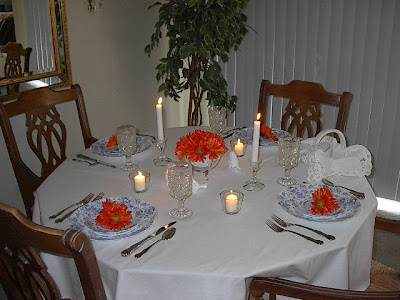
You are a GUI agent. You are given a task and a screenshot of the screen. Output one action in this format:
    pyautogui.click(x=<x>, y=<y>)
    Task: Click on the silverware
    The image size is (400, 300).
    Given the screenshot: What is the action you would take?
    pyautogui.click(x=62, y=211), pyautogui.click(x=59, y=219), pyautogui.click(x=123, y=252), pyautogui.click(x=143, y=255), pyautogui.click(x=317, y=243), pyautogui.click(x=326, y=235), pyautogui.click(x=362, y=195), pyautogui.click(x=107, y=164), pyautogui.click(x=78, y=158)